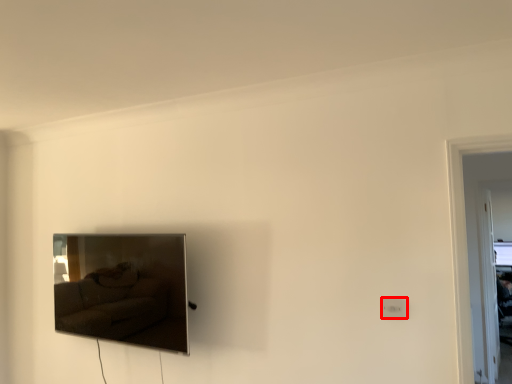
Question: From the image's perspective, what is the correct spatial relationship of electric outlet (annotated by the red box) in relation to picture frame?

Choices:
 (A) below
 (B) above

Answer: (B)